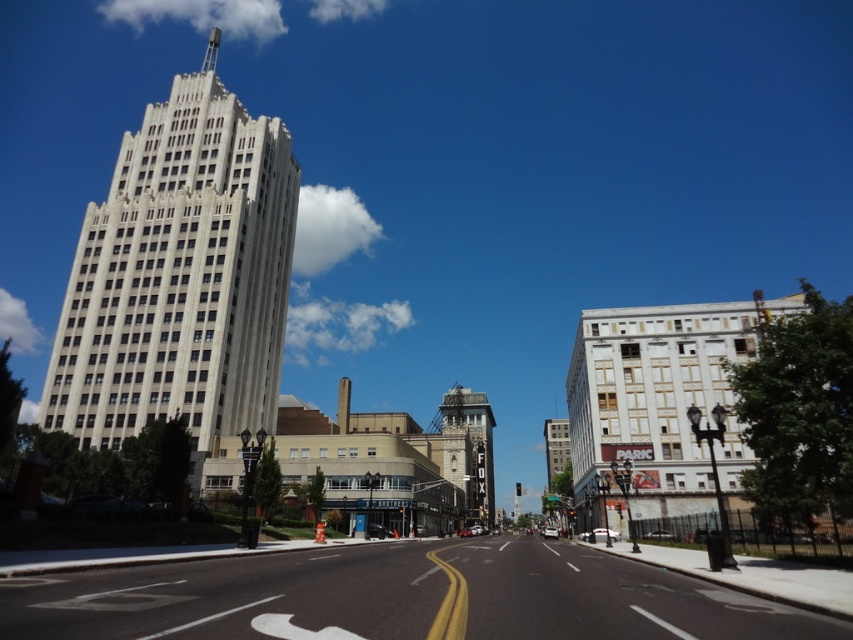
Is point (265, 289) farther from viewer compared to point (491, 461)?

No.

Between point (158, 241) and point (480, 412), which one is positioned behind?

The point (480, 412) is more distant.

Locate an element on the screen. Image resolution: width=853 pixels, height=640 pixels. white stone building at left is located at coordinates (180, 276).